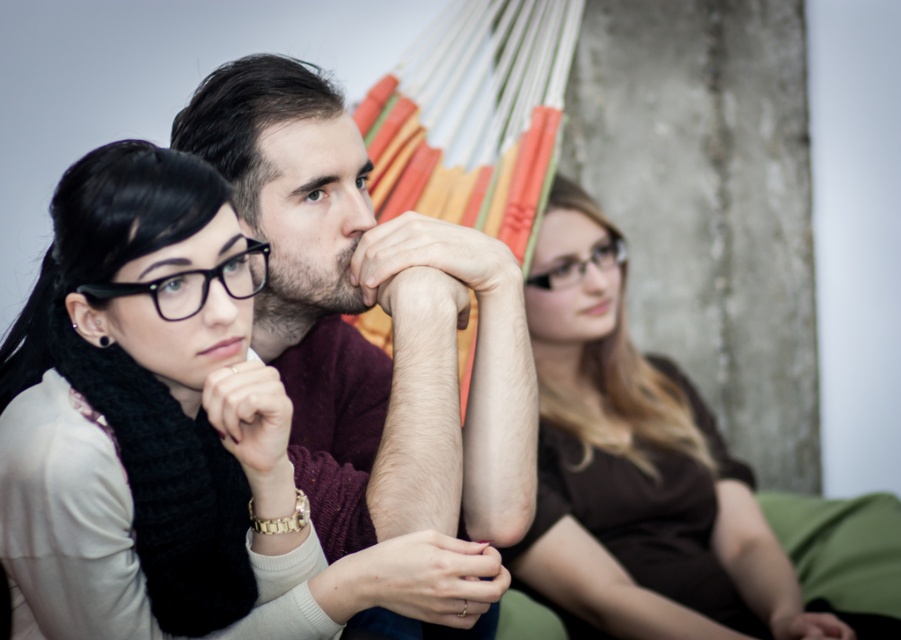
Question: Does matte black scarf at center appear on the right side of clear plastic glasses at center?

Choices:
 (A) no
 (B) yes

Answer: (A)

Question: Is maroon sweater at center below clear plastic glasses at center?

Choices:
 (A) no
 (B) yes

Answer: (B)

Question: Which point appears closest to the camera in this image?

Choices:
 (A) (168, 296)
 (B) (139, 634)

Answer: (A)

Question: Is matte black scarf at center thinner than brown matte shirt at center?

Choices:
 (A) yes
 (B) no

Answer: (A)

Question: Which of the following is the farthest from the observer?

Choices:
 (A) maroon sweater at center
 (B) clear plastic glasses at center
 (C) matte black scarf at center
 (D) brown matte shirt at center

Answer: (B)

Question: Among these objects, which one is farthest from the camera?

Choices:
 (A) clear plastic glasses at center
 (B) matte black scarf at center

Answer: (A)